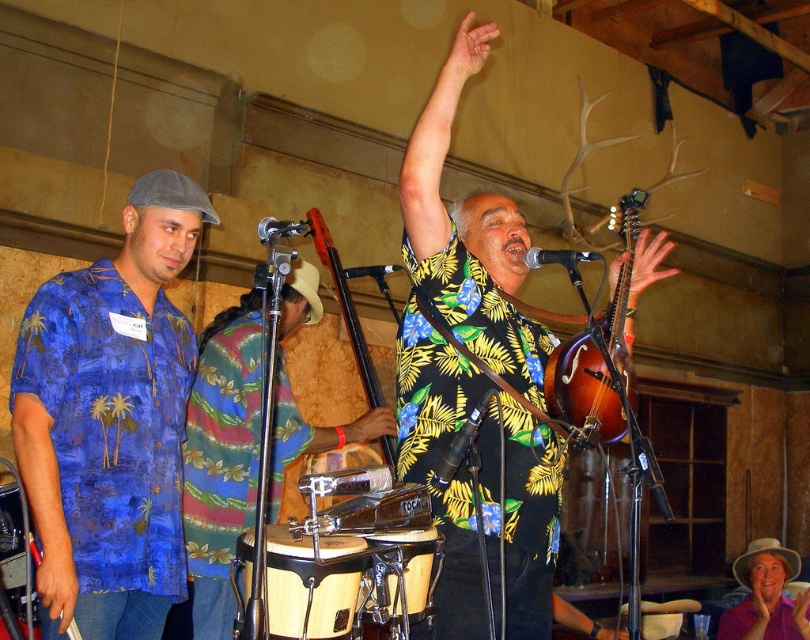
Question: Does multicolored fabric shirt at center have a greater width compared to wooden bongo drum at center?

Choices:
 (A) no
 (B) yes

Answer: (B)

Question: Is light brown wooden drum at center to the right of wooden drum at center from the viewer's perspective?

Choices:
 (A) yes
 (B) no

Answer: (B)

Question: Which object is closer to the camera taking this photo?

Choices:
 (A) blue floral shirt at left
 (B) brown wooden mandolin at center

Answer: (B)

Question: Which point is farther to the camera?

Choices:
 (A) (403, 532)
 (B) (182, 195)

Answer: (B)

Question: Considering the real-world distances, which object is farthest from the blue floral shirt at left?

Choices:
 (A) wooden bongo drum at center
 (B) wooden drum at center
 (C) light brown wooden drum at center

Answer: (A)

Question: Does blue floral shirt at left have a lesser width compared to multicolored fabric shirt at center?

Choices:
 (A) yes
 (B) no

Answer: (A)